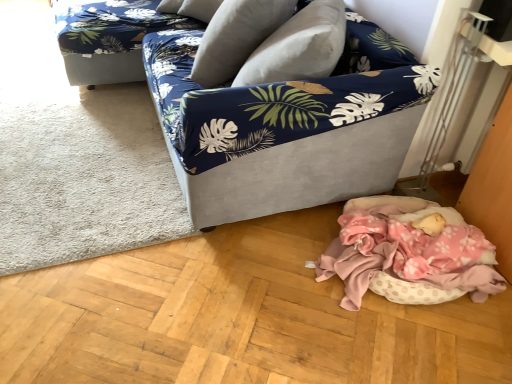
I want to click on vacant space in front of pink polka dot fabric at lower right, so click(404, 349).